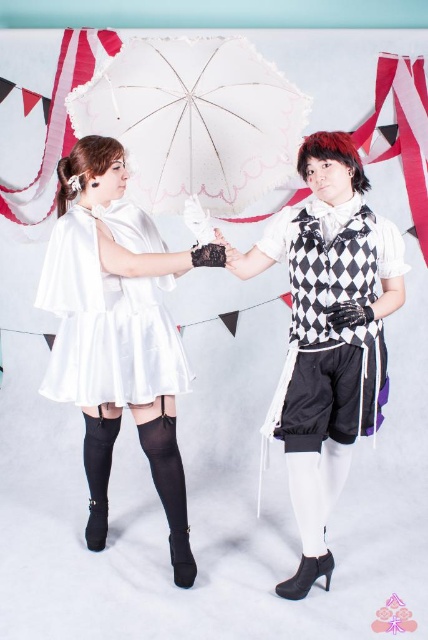
Can you confirm if white satin dress at left is bigger than white lace umbrella at center?

Yes, white satin dress at left is bigger than white lace umbrella at center.

Which is above, white satin dress at left or white lace umbrella at center?

Positioned higher is white lace umbrella at center.

Where is `white satin dress at left`? The height and width of the screenshot is (640, 428). white satin dress at left is located at coordinates (118, 332).

Identify the location of white satin dress at left. This screenshot has width=428, height=640. (118, 332).

Based on the photo, is matte black vest at center positioned in front of white lace umbrella at center?

No.

Locate an element on the screen. This screenshot has height=640, width=428. matte black vest at center is located at coordinates (183, 349).

Where is `matte black vest at center`? This screenshot has height=640, width=428. matte black vest at center is located at coordinates (183, 349).

Who is positioned more to the left, white satin dress at left or black and white checkered vest at right?

→ white satin dress at left is more to the left.

This screenshot has height=640, width=428. What are the coordinates of `white satin dress at left` in the screenshot? It's located at (118, 332).

Locate an element on the screen. white satin dress at left is located at coordinates (118, 332).

Identify the location of white satin dress at left. This screenshot has height=640, width=428. (118, 332).